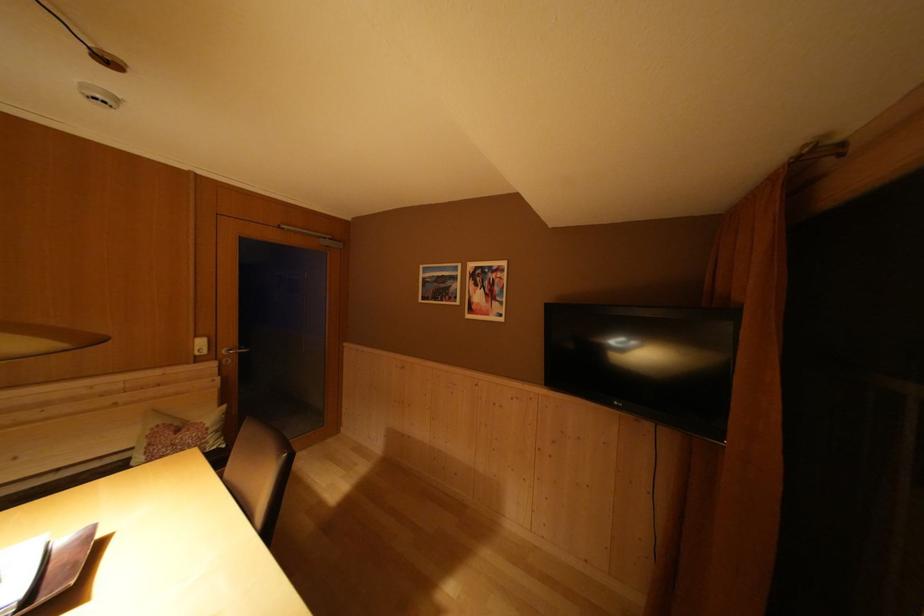
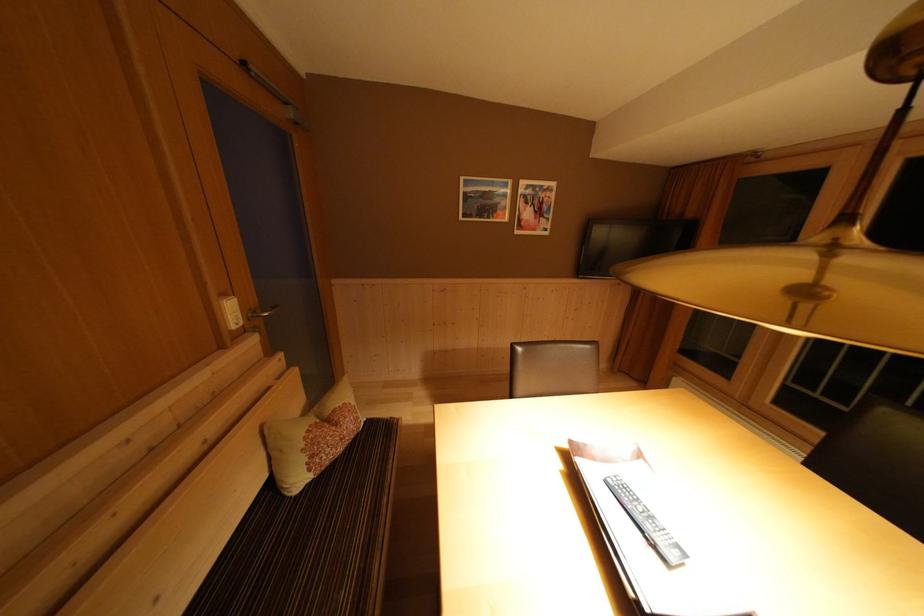
The point at (156, 450) is marked in the first image. Where is the corresponding point in the second image?

(319, 462)